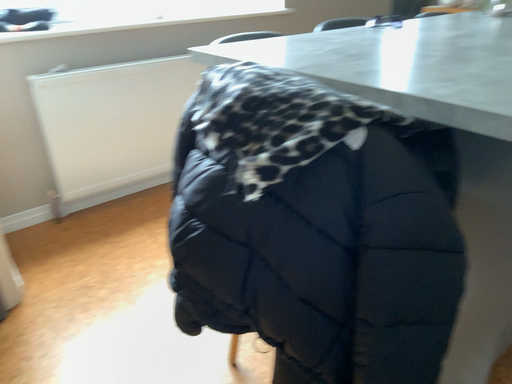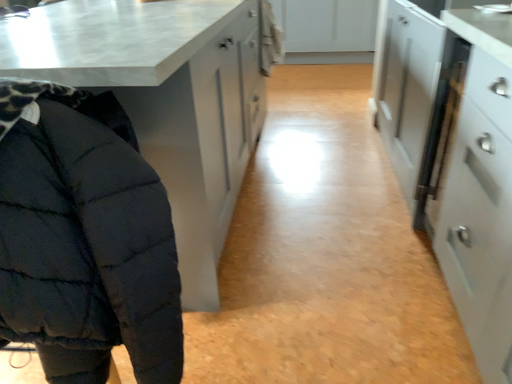
Question: How did the camera likely rotate when shooting the video?

Choices:
 (A) rotated left
 (B) rotated right

Answer: (B)